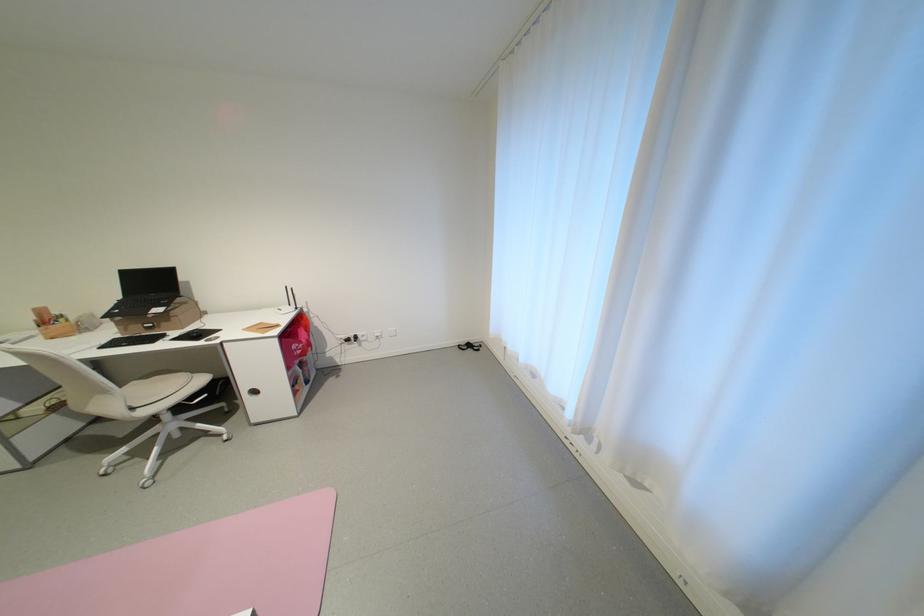
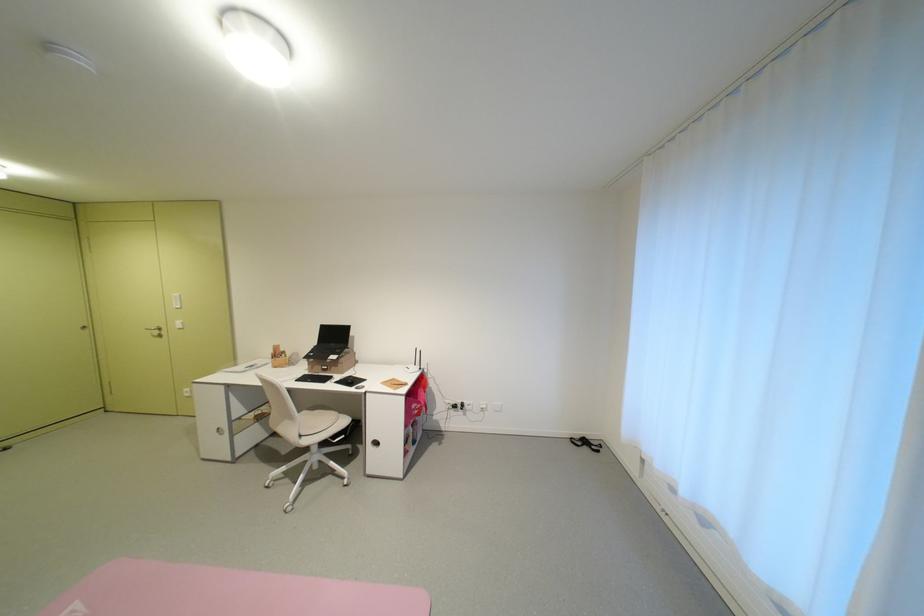
Find the pixel in the second image that matches point 71,321 in the first image.

(293, 357)